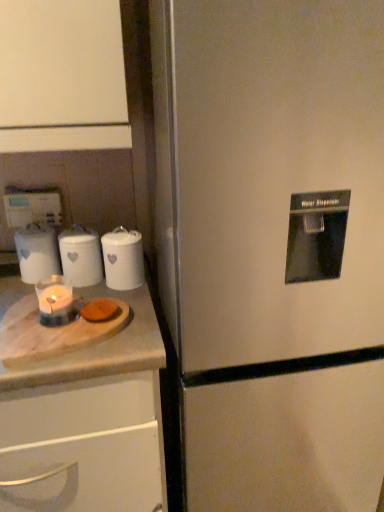
Question: From the image's perspective, would you say satin silver refrigerator at center is shown under white marble cutting board at left?

Choices:
 (A) yes
 (B) no

Answer: (B)

Question: Is white marble cutting board at left inside satin silver refrigerator at center?

Choices:
 (A) no
 (B) yes

Answer: (A)

Question: Could you tell me if satin silver refrigerator at center is facing white marble cutting board at left?

Choices:
 (A) no
 (B) yes

Answer: (A)

Question: Is satin silver refrigerator at center at the right side of white marble cutting board at left?

Choices:
 (A) yes
 (B) no

Answer: (A)

Question: Does satin silver refrigerator at center have a greater width compared to white marble cutting board at left?

Choices:
 (A) yes
 (B) no

Answer: (B)

Question: From a real-world perspective, is satin silver refrigerator at center located beneath white marble cutting board at left?

Choices:
 (A) no
 (B) yes

Answer: (A)

Question: Is satin silver refrigerator at center thinner than white glossy canister at upper left, positioned as the 1th kitchen appliance in right-to-left order?

Choices:
 (A) no
 (B) yes

Answer: (A)

Question: From a real-world perspective, is satin silver refrigerator at center on white glossy canister at upper left, placed as the second kitchen appliance when sorted from left to right?

Choices:
 (A) no
 (B) yes

Answer: (A)

Question: Does satin silver refrigerator at center have a greater height compared to white glossy canister at upper left, placed as the second kitchen appliance when sorted from left to right?

Choices:
 (A) yes
 (B) no

Answer: (A)

Question: From a real-world perspective, is satin silver refrigerator at center positioned under white glossy canister at upper left, placed as the second kitchen appliance when sorted from left to right, based on gravity?

Choices:
 (A) no
 (B) yes

Answer: (B)

Question: Is satin silver refrigerator at center behind white glossy canister at upper left, placed as the second kitchen appliance when sorted from left to right?

Choices:
 (A) yes
 (B) no

Answer: (B)

Question: Considering the relative sizes of satin silver refrigerator at center and white glossy canister at upper left, positioned as the 1th kitchen appliance in right-to-left order, in the image provided, is satin silver refrigerator at center smaller than white glossy canister at upper left, positioned as the 1th kitchen appliance in right-to-left order,?

Choices:
 (A) yes
 (B) no

Answer: (B)

Question: From a real-world perspective, is white glossy canister at upper left, placed as the second kitchen appliance when sorted from left to right, physically below brown matte cookie at lower left?

Choices:
 (A) no
 (B) yes

Answer: (A)